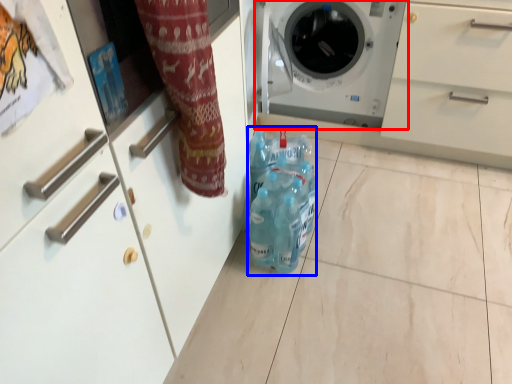
Question: Which object appears closest to the camera in this image, washing machine (highlighted by a red box) or cleaning product (highlighted by a blue box)?

Choices:
 (A) washing machine
 (B) cleaning product

Answer: (B)